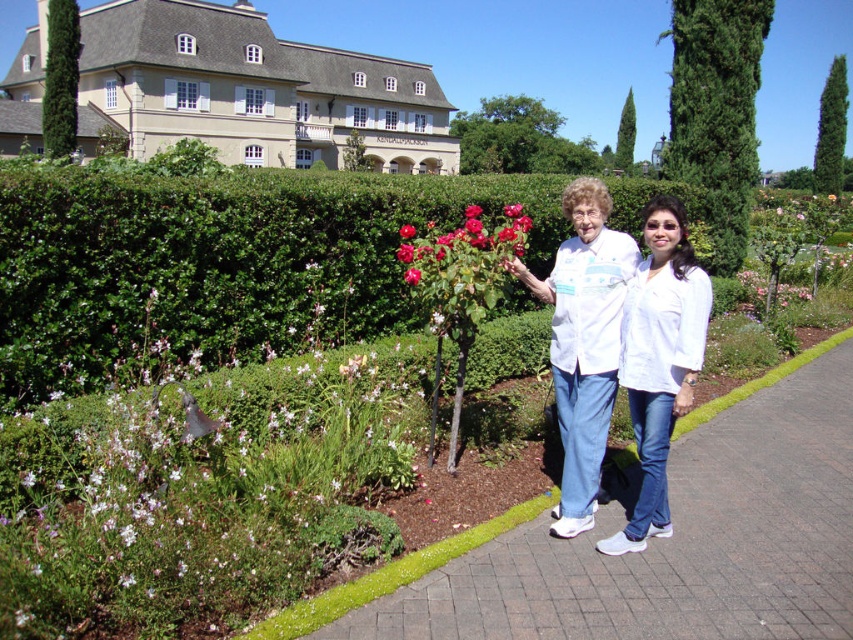
Between white matte lab coat at center and shiny red rose at center, which one is positioned higher?

Positioned higher is shiny red rose at center.

Identify the location of white matte lab coat at center. (663, 326).

Is the position of green leafy bush at upper right less distant than that of white matte lab coat at center?

That is False.

In the scene shown: Which is more to the right, green leafy bush at upper right or white matte lab coat at center?

From the viewer's perspective, green leafy bush at upper right appears more on the right side.

Between point (718, 74) and point (676, 336), which one is positioned behind?

The point (718, 74) is behind.

This screenshot has width=853, height=640. Identify the location of green leafy bush at upper right. (717, 113).

Which is more to the left, white cotton shirt at center or green leafy bush at upper right?

From the viewer's perspective, white cotton shirt at center appears more on the left side.

Between white cotton shirt at center and green leafy bush at upper right, which one is positioned higher?

Positioned higher is green leafy bush at upper right.

Is point (573, 349) farther from viewer compared to point (691, 20)?

No, (573, 349) is closer to viewer.

Find the location of a particular element. white cotton shirt at center is located at coordinates (583, 342).